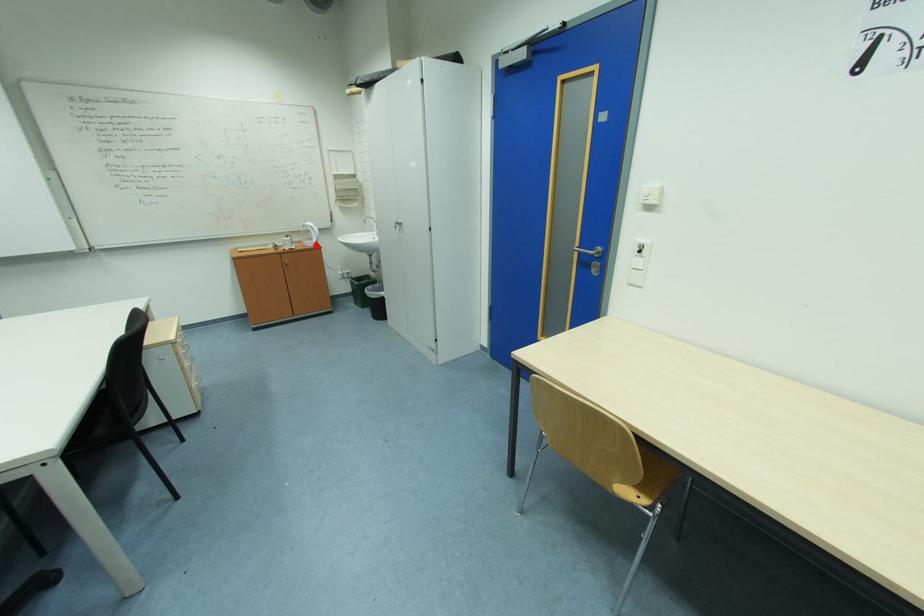
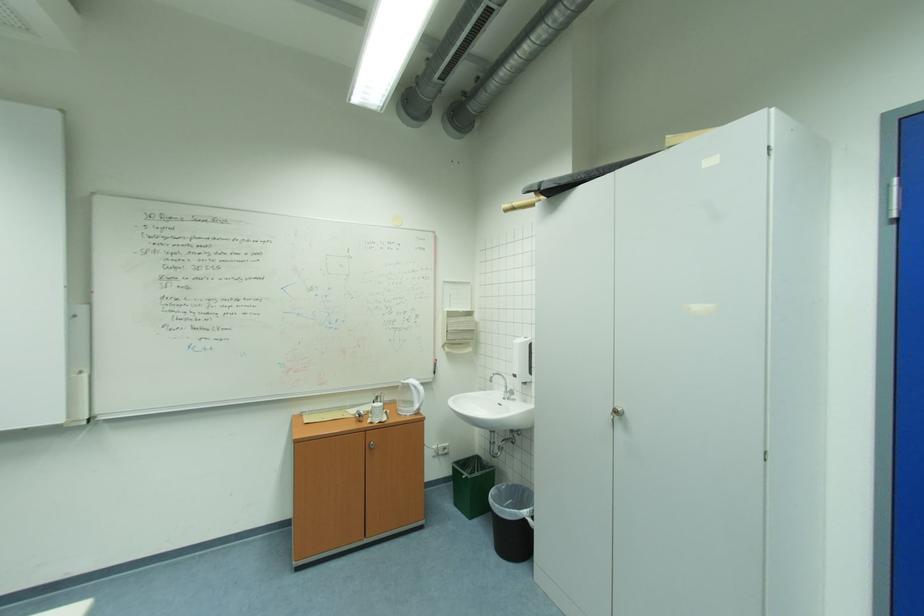
Where in the second image is the point corresponding to the highlighted location from the first image?

(415, 411)